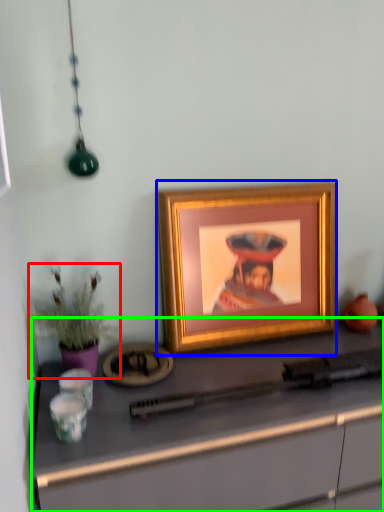
Question: Which object is the farthest from houseplant (highlighted by a red box)? Choose among these: picture frame (highlighted by a blue box) or desk (highlighted by a green box).

Choices:
 (A) picture frame
 (B) desk

Answer: (A)